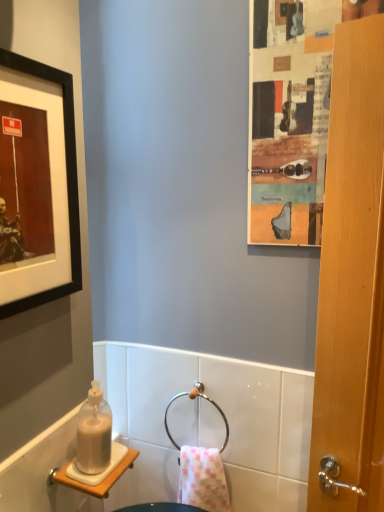
Question: Can you confirm if black matte picture frame at upper left is bigger than pink checkered towel at center?

Choices:
 (A) no
 (B) yes

Answer: (A)

Question: Is black matte picture frame at upper left turned away from pink checkered towel at center?

Choices:
 (A) no
 (B) yes

Answer: (A)

Question: Does black matte picture frame at upper left have a greater width compared to pink checkered towel at center?

Choices:
 (A) yes
 (B) no

Answer: (B)

Question: From the image's perspective, does black matte picture frame at upper left appear higher than pink checkered towel at center?

Choices:
 (A) yes
 (B) no

Answer: (A)

Question: Considering the relative sizes of black matte picture frame at upper left and pink checkered towel at center in the image provided, is black matte picture frame at upper left smaller than pink checkered towel at center?

Choices:
 (A) no
 (B) yes

Answer: (B)

Question: From the image's perspective, is wooden-framed collage at upper right positioned above or below pink checkered towel at center?

Choices:
 (A) above
 (B) below

Answer: (A)

Question: Is wooden-framed collage at upper right taller or shorter than pink checkered towel at center?

Choices:
 (A) short
 (B) tall

Answer: (B)

Question: In the image, is wooden-framed collage at upper right positioned in front of or behind pink checkered towel at center?

Choices:
 (A) behind
 (B) front

Answer: (B)

Question: From a real-world perspective, is wooden-framed collage at upper right physically located above or below pink checkered towel at center?

Choices:
 (A) below
 (B) above

Answer: (B)

Question: Which is correct: polished metal towel ring at center is inside wooden-framed collage at upper right, or outside of it?

Choices:
 (A) outside
 (B) inside

Answer: (A)

Question: Considering the positions of polished metal towel ring at center and wooden-framed collage at upper right in the image, is polished metal towel ring at center wider or thinner than wooden-framed collage at upper right?

Choices:
 (A) wide
 (B) thin

Answer: (A)

Question: Is point (192, 397) closer or farther from the camera than point (266, 166)?

Choices:
 (A) closer
 (B) farther

Answer: (B)

Question: From a real-world perspective, is polished metal towel ring at center physically located above or below wooden-framed collage at upper right?

Choices:
 (A) below
 (B) above

Answer: (A)

Question: From the image's perspective, relative to polished metal towel ring at center, is wooden-framed collage at upper right above or below?

Choices:
 (A) above
 (B) below

Answer: (A)

Question: Considering the positions of point (278, 130) and point (185, 393), is point (278, 130) closer or farther from the camera than point (185, 393)?

Choices:
 (A) closer
 (B) farther

Answer: (A)